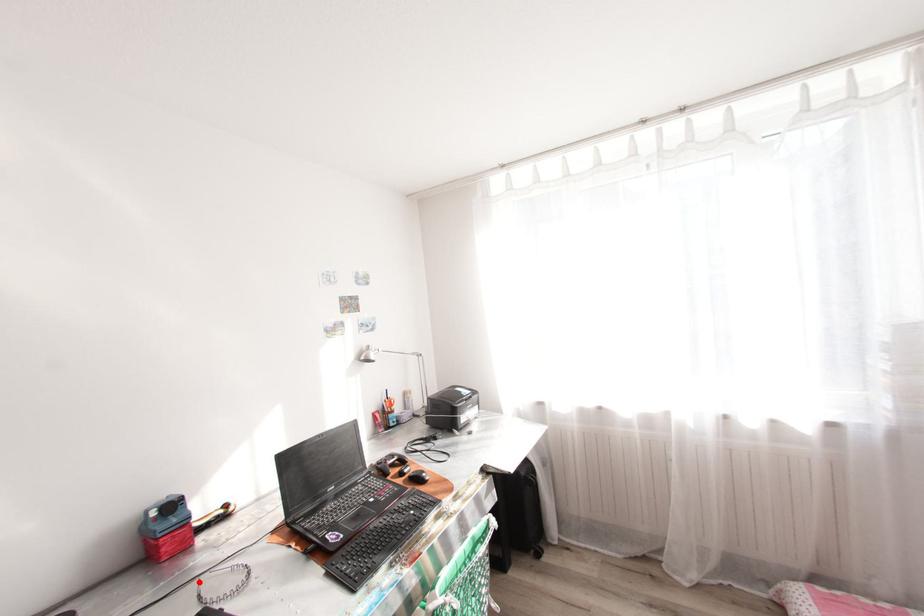
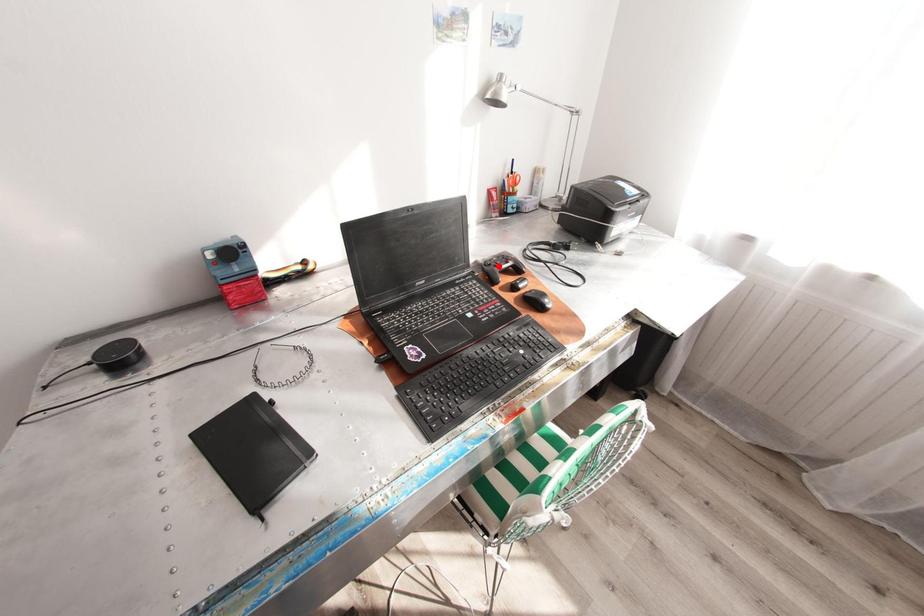
I am providing you with two images of the same scene from different viewpoints. A red point is marked on the first image and another point is marked on the second image. Are the points marked in image1 and image2 representing the same 3D position?

No